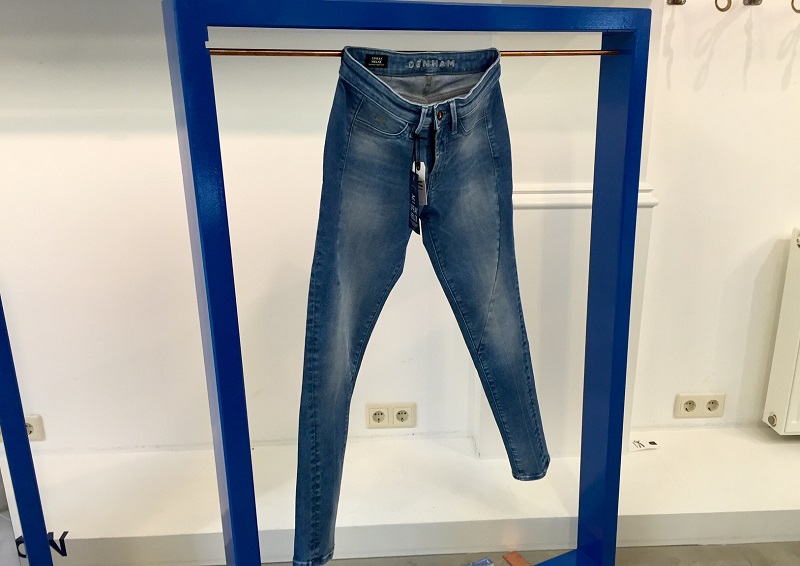
You are a GUI agent. You are given a task and a screenshot of the screen. Output one action in this format:
    pyautogui.click(x=<x>, y=<y>)
    Task: Click on the wall
    This screenshot has width=800, height=566.
    Given the screenshot: What is the action you would take?
    pyautogui.click(x=117, y=301)